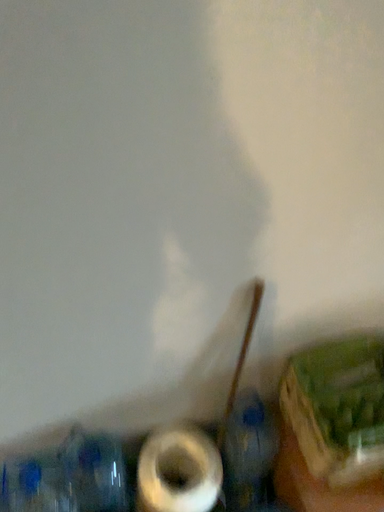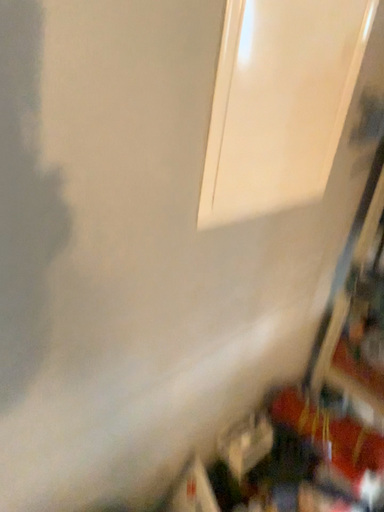
Question: Which way did the camera rotate in the video?

Choices:
 (A) rotated upward
 (B) rotated downward

Answer: (A)